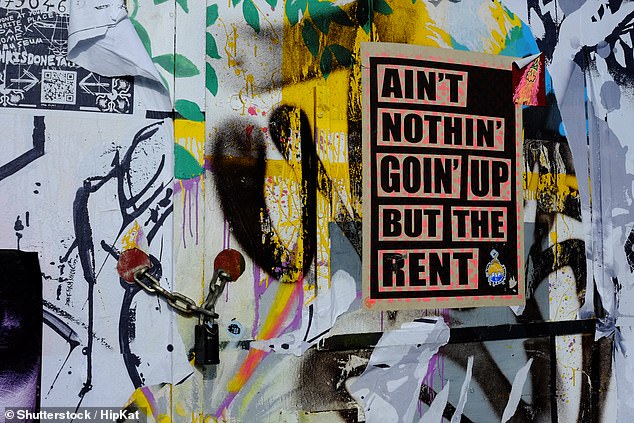
Image resolution: width=634 pixels, height=423 pixels. In order to click on white paint in this screenshot , I will do `click(410, 333)`, `click(343, 292)`, `click(581, 29)`, `click(626, 131)`, `click(574, 230)`.